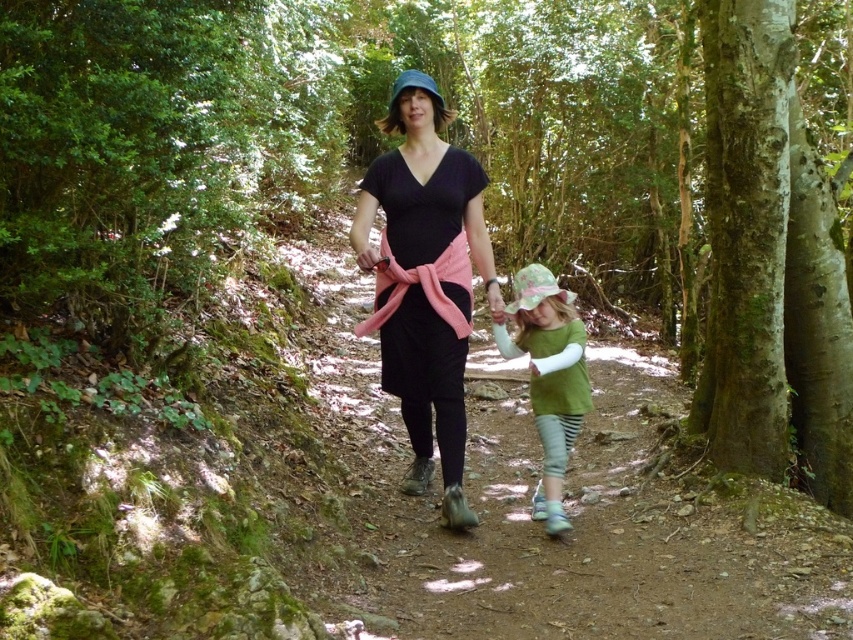
You are a photographer trying to capture both the matte black dress at center and the green cotton shirt at center in a single frame. Since the camera can only focus on one subject at a time, which item should you focus on to ensure it fills most of the frame?

The matte black dress at center is bigger than the green cotton shirt at center, so you should focus on the matte black dress at center to ensure it fills most of the frame.

You are standing at the origin point in the forest scene. Where is the matte black dress at center located in terms of coordinates?

The matte black dress at center is located at coordinates point (x=425, y=280).